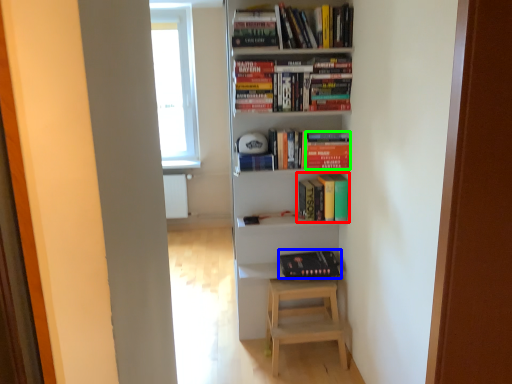
Question: Considering the real-world distances, which object is farthest from book (highlighted by a red box)? book (highlighted by a blue box) or paperback book (highlighted by a green box)?

Choices:
 (A) book
 (B) paperback book

Answer: (A)